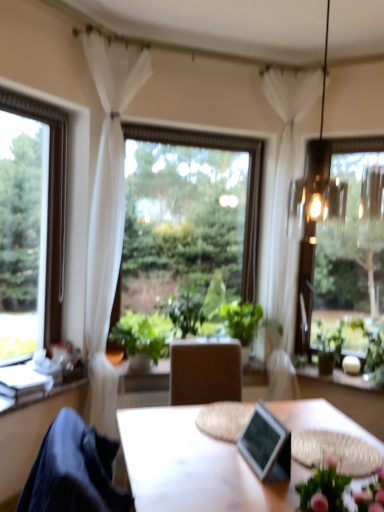
Find the location of `free space above green matte vase at right (from a real-world perspective)`. free space above green matte vase at right (from a real-world perspective) is located at coordinates (334, 372).